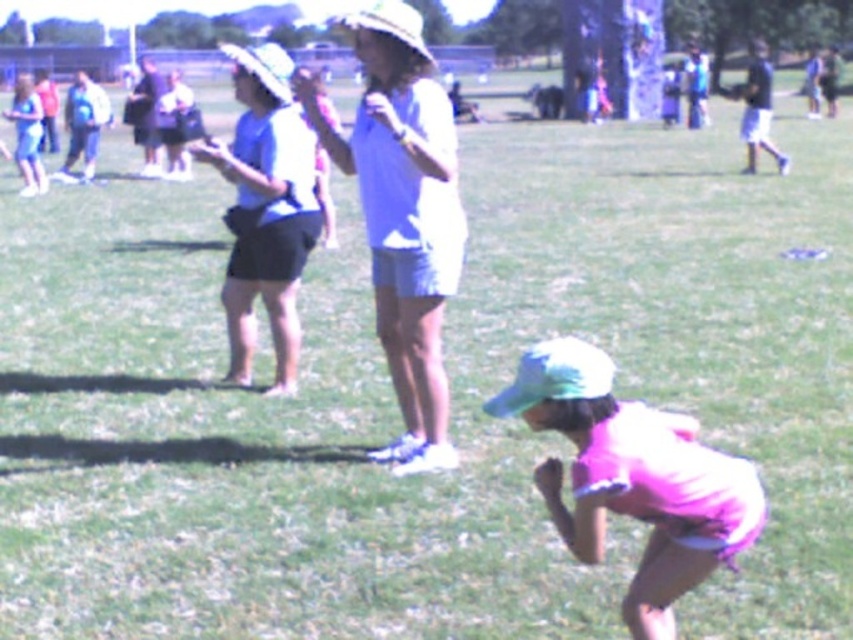
Does pink fabric cap at lower right have a smaller size compared to matte blue shirt at upper center?

Yes.

Between pink fabric cap at lower right and matte blue shirt at upper center, which one has less height?

pink fabric cap at lower right

I want to click on pink fabric cap at lower right, so click(633, 477).

Which of these two, matte blue shirt at center or pink fabric cap at lower right, stands taller?

matte blue shirt at center is taller.

Between matte blue shirt at center and pink fabric cap at lower right, which one has less height?

With less height is pink fabric cap at lower right.

Is point (397, 256) behind point (698, 548)?

Yes, point (397, 256) is behind point (698, 548).

Identify the location of matte blue shirt at center. (403, 216).

Does matte blue shirt at center appear over matte blue shirt at upper center?

Actually, matte blue shirt at center is below matte blue shirt at upper center.

The width and height of the screenshot is (853, 640). Describe the element at coordinates (403, 216) in the screenshot. I see `matte blue shirt at center` at that location.

You are a GUI agent. You are given a task and a screenshot of the screen. Output one action in this format:
    pyautogui.click(x=<x>, y=<y>)
    Task: Click on the matte blue shirt at center
    The height and width of the screenshot is (640, 853).
    Given the screenshot: What is the action you would take?
    pyautogui.click(x=403, y=216)